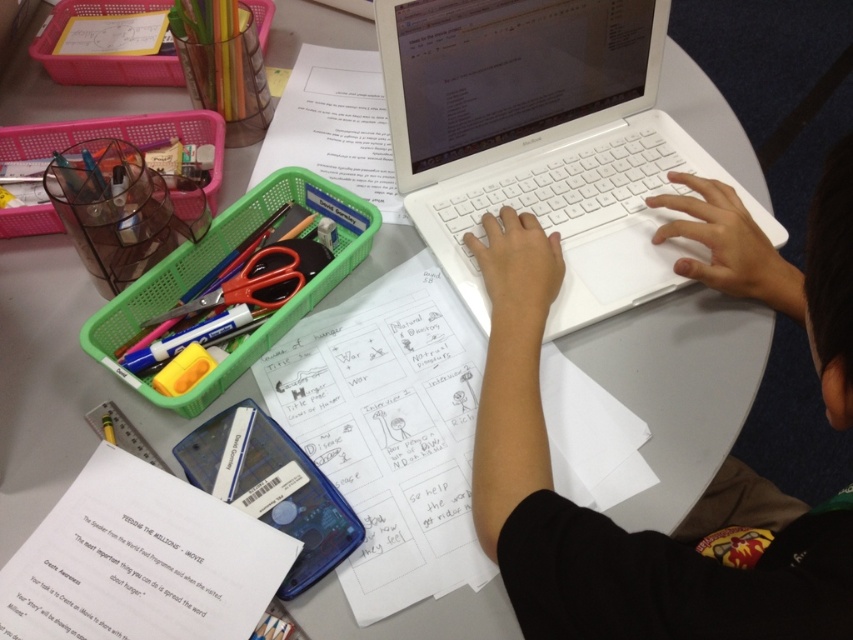
Question: Which point is farther to the camera?

Choices:
 (A) red plastic scissors at upper left
 (B) translucent plastic tray at left
 (C) white plastic ruler at lower center
 (D) white plastic hands at center

Answer: (A)

Question: Does white paper at lower left appear over white paper at upper center?

Choices:
 (A) yes
 (B) no

Answer: (B)

Question: Does white plastic laptop at center lie behind blue plastic phone case at lower center?

Choices:
 (A) yes
 (B) no

Answer: (A)

Question: Can you confirm if white paper at lower left is smaller than white paper at upper center?

Choices:
 (A) no
 (B) yes

Answer: (B)

Question: Estimate the real-world distances between objects in this image. Which object is farther from the white paper at upper center?

Choices:
 (A) white plastic laptop at center
 (B) blue plastic phone case at lower center
 (C) white paper at lower left

Answer: (C)

Question: Which is nearer to the red plastic scissors at upper left?

Choices:
 (A) white paper at lower left
 (B) translucent plastic cup at upper left

Answer: (A)